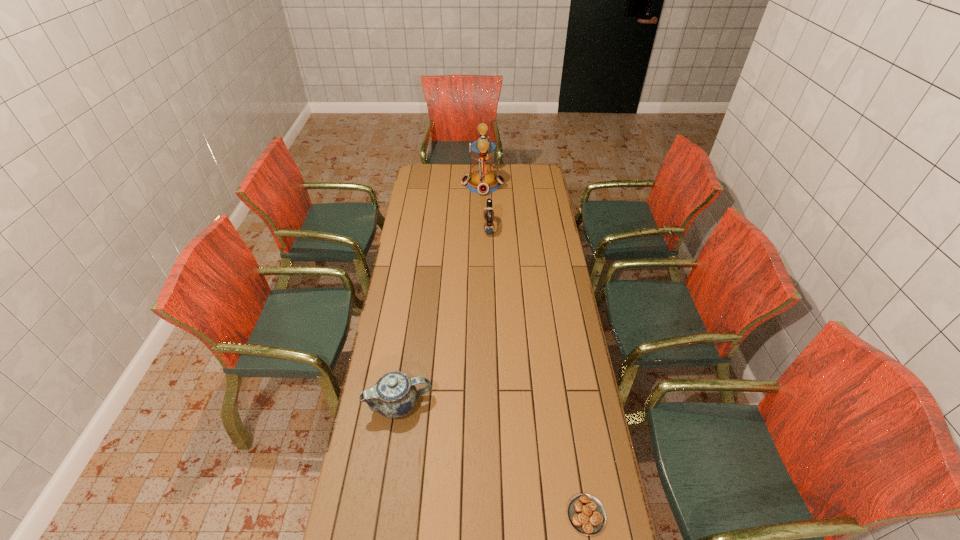
Where is `the farthest object`? The image size is (960, 540). the farthest object is located at coordinates (482, 180).

The height and width of the screenshot is (540, 960). What are the coordinates of `the tallest object` in the screenshot? It's located at (482, 180).

Where is `the third nearest object`? the third nearest object is located at coordinates (489, 227).

I want to click on the second nearest object, so click(x=394, y=395).

Where is `the leftmost object`? the leftmost object is located at coordinates (394, 395).

I want to click on the nearest object, so click(x=586, y=514).

This screenshot has width=960, height=540. In order to click on the rightmost object in this screenshot , I will do `click(586, 514)`.

At what (x,y) coordinates should I click in order to perform the action: click on vacant region located 0.170m on the front-facing side of the lantern. Please return your answer as a coordinate pair (x, y). Looking at the image, I should click on click(x=432, y=184).

I want to click on vacant area located on the front-facing side of the lantern, so click(x=449, y=184).

At what (x,y) coordinates should I click in order to perform the action: click on vacant space located 0.120m on the front-facing side of the lantern. Please return your answer as a coordinate pair (x, y). Looking at the image, I should click on (441, 184).